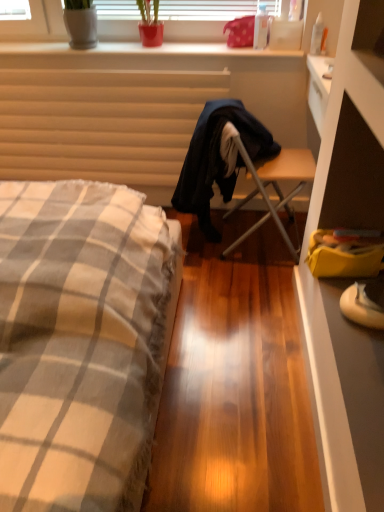
Locate an element on the screen. free spot in front of dark blue fabric robe at center is located at coordinates (232, 289).